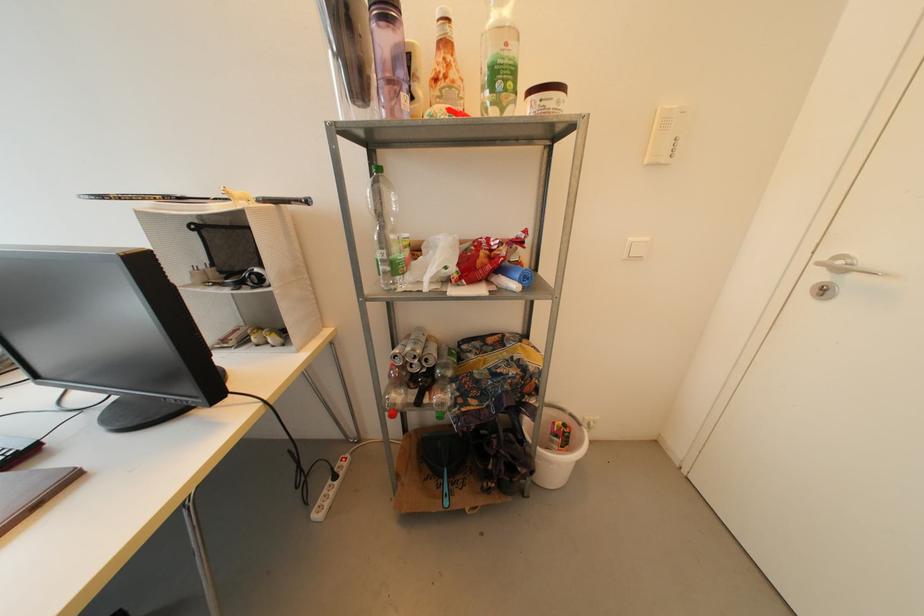
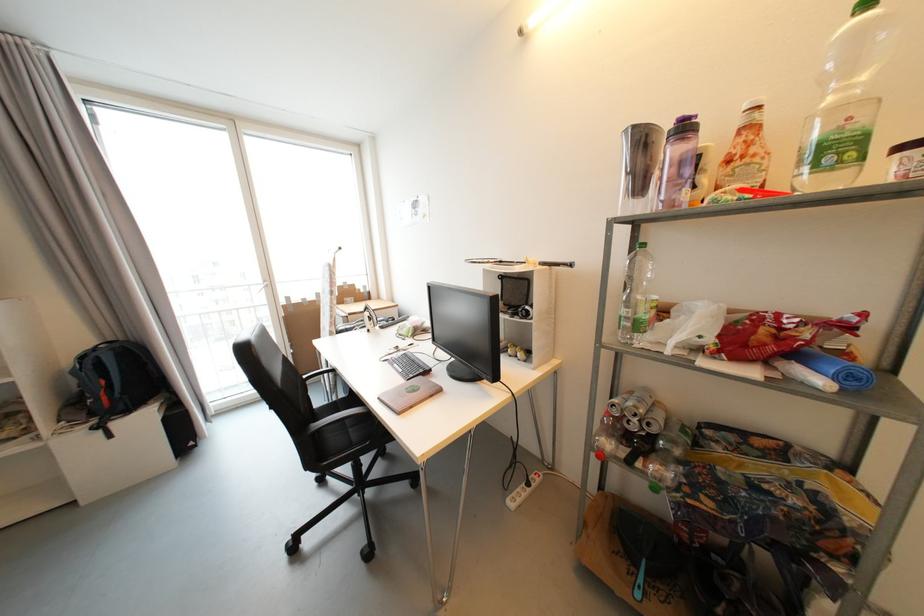
Locate, in the second image, the point that corresponds to [412,351] in the first image.

(635, 406)